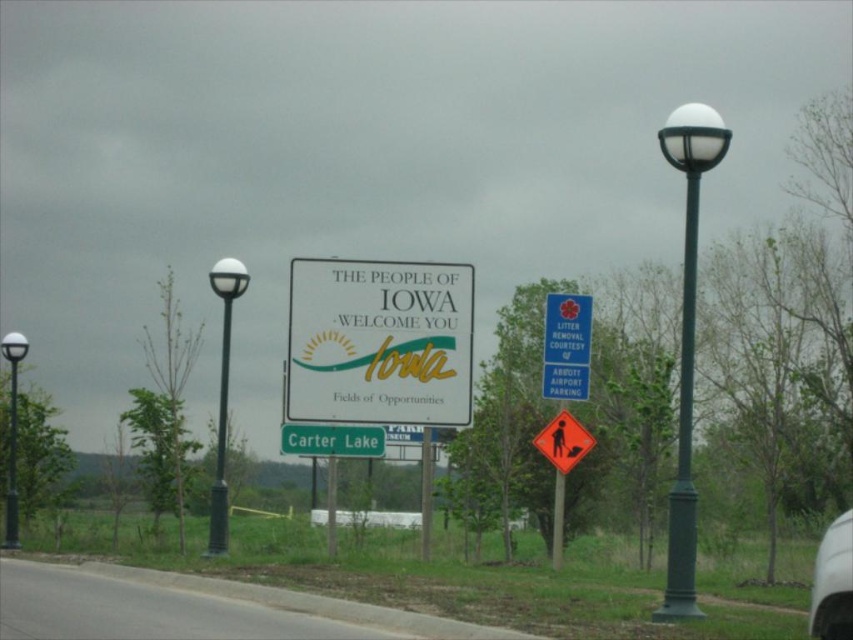
You are a driver approaching the matte white sign at center and the green matte sign at center on a road in Iowa. Which sign will you notice first as you drive closer to them?

The matte white sign at center has a larger size compared to the green matte sign at center, so you will notice the matte white sign at center first as you drive closer to them.